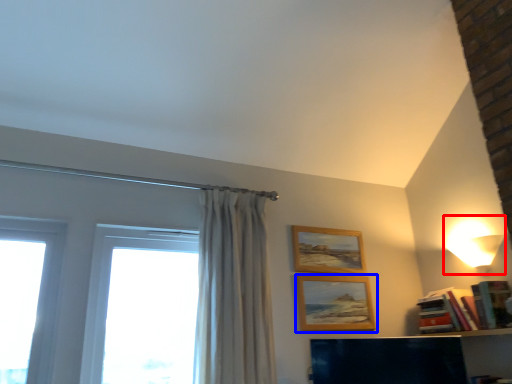
Question: Which of the following is the closest to the observer, lamp (highlighted by a red box) or picture frame (highlighted by a blue box)?

Choices:
 (A) lamp
 (B) picture frame

Answer: (A)